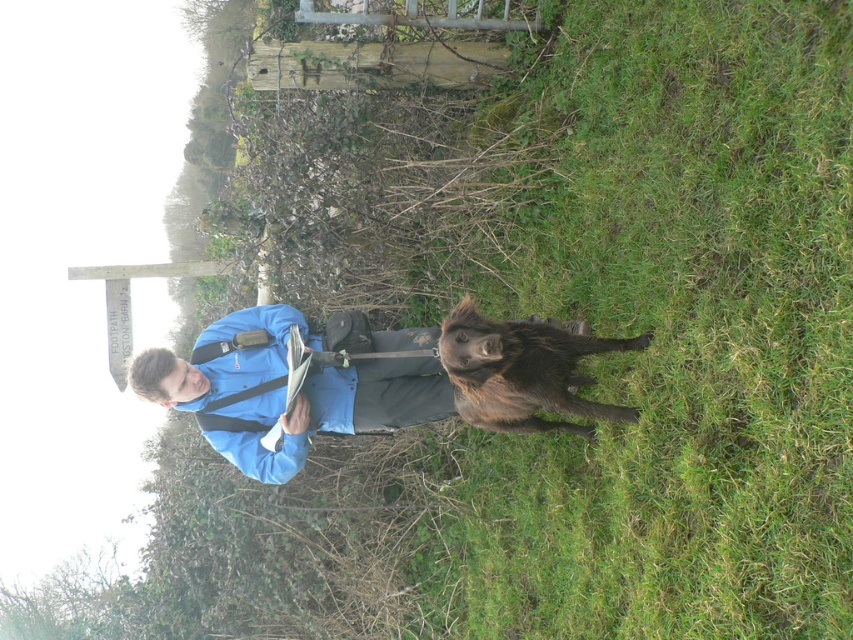
Where is `green grass at center`? Image resolution: width=853 pixels, height=640 pixels. green grass at center is located at coordinates (680, 339).

The width and height of the screenshot is (853, 640). What do you see at coordinates (680, 339) in the screenshot?
I see `green grass at center` at bounding box center [680, 339].

The height and width of the screenshot is (640, 853). I want to click on green grass at center, so click(680, 339).

Does point (257, 412) lie in front of point (476, 376)?

No.

Does blue fabric jacket at center lie in front of brown furry dog at center?

No, blue fabric jacket at center is behind brown furry dog at center.

You are a GUI agent. You are given a task and a screenshot of the screen. Output one action in this format:
    pyautogui.click(x=<x>, y=<y>)
    Task: Click on the blue fabric jacket at center
    
    Given the screenshot: What is the action you would take?
    pyautogui.click(x=286, y=384)

Between green grass at center and blue fabric jacket at center, which one has more height?

green grass at center

Is point (683, 118) farther from camera compared to point (271, 346)?

No.

Which is in front, point (722, 344) or point (206, 410)?

Positioned in front is point (722, 344).

At what (x,y) coordinates should I click in order to perform the action: click on green grass at center. Please return your answer as a coordinate pair (x, y). This screenshot has width=853, height=640. Looking at the image, I should click on (680, 339).